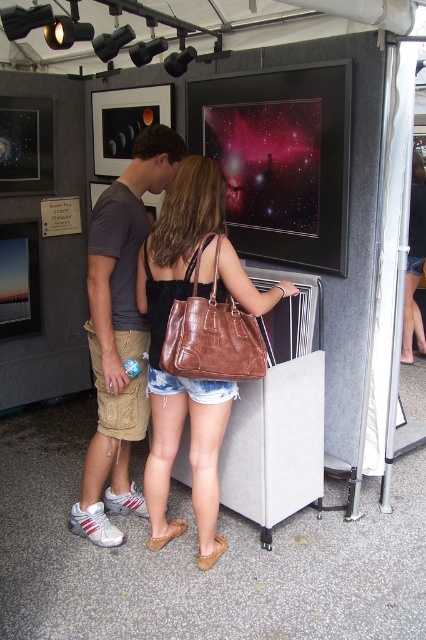
Is point (143, 477) farther from camera compared to point (118, 394)?

Yes, it is.

Does brown leather purse at center have a larger size compared to khaki cargo shorts at center?

Actually, brown leather purse at center might be smaller than khaki cargo shorts at center.

At what (x,y) coordinates should I click in order to perform the action: click on brown leather purse at center. Please return your answer as a coordinate pair (x, y). Looking at the image, I should click on (164, 339).